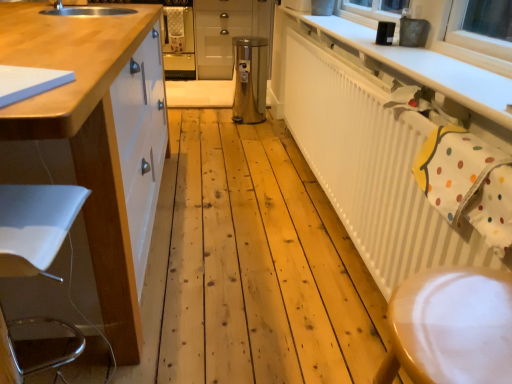
The height and width of the screenshot is (384, 512). In order to click on free space below white textured radiator at upper right (from a real-world perspective) in this screenshot , I will do `click(330, 220)`.